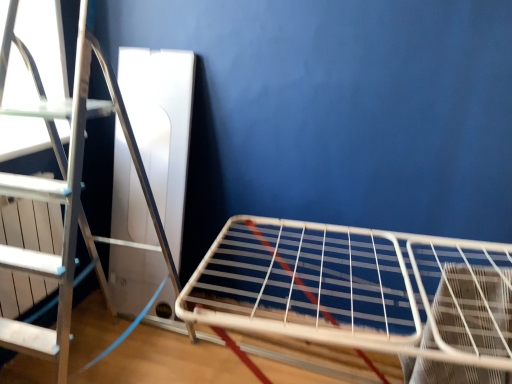
This screenshot has height=384, width=512. Find the location of `white wire rack at lower right`. white wire rack at lower right is located at coordinates (361, 291).

Describe the element at coordinates (361, 291) in the screenshot. I see `white wire rack at lower right` at that location.

In order to face silver metallic ladder at left, should I rotate leftwards or rightwards?

It's best to rotate left around 23.768 degrees.

The height and width of the screenshot is (384, 512). I want to click on silver metallic ladder at left, so click(x=64, y=215).

Describe the element at coordinates (64, 215) in the screenshot. I see `silver metallic ladder at left` at that location.

Find the location of a particular element. This screenshot has height=384, width=512. white wire rack at lower right is located at coordinates click(361, 291).

Would you say white wire rack at lower right is to the left or to the right of silver metallic ladder at left in the picture?

In the image, white wire rack at lower right appears on the right side of silver metallic ladder at left.

In the image, is white wire rack at lower right positioned in front of or behind silver metallic ladder at left?

Visually, white wire rack at lower right is located in front of silver metallic ladder at left.

Considering the points (244, 245) and (21, 47), which point is behind, point (244, 245) or point (21, 47)?

Point (21, 47)

From the image's perspective, relative to silver metallic ladder at left, is white wire rack at lower right above or below?

From the image's perspective, white wire rack at lower right appears below silver metallic ladder at left.

From a real-world perspective, is white wire rack at lower right positioned over silver metallic ladder at left based on gravity?

No, from a real-world perspective, white wire rack at lower right is not above silver metallic ladder at left.

Considering the relative sizes of white wire rack at lower right and silver metallic ladder at left in the image provided, is white wire rack at lower right thinner than silver metallic ladder at left?

Incorrect, the width of white wire rack at lower right is not less than that of silver metallic ladder at left.

Between white wire rack at lower right and silver metallic ladder at left, which one has less height?

white wire rack at lower right.

Is white wire rack at lower right bigger or smaller than silver metallic ladder at left?

In the image, white wire rack at lower right appears to be smaller than silver metallic ladder at left.

Is silver metallic ladder at left surrounded by white wire rack at lower right?

That's incorrect, silver metallic ladder at left is not inside white wire rack at lower right.

Is white wire rack at lower right placed right next to silver metallic ladder at left?

No, white wire rack at lower right is not next to silver metallic ladder at left.

Based on the photo, does white wire rack at lower right turn towards silver metallic ladder at left?

No, white wire rack at lower right is not oriented towards silver metallic ladder at left.

Can you tell me how much white wire rack at lower right and silver metallic ladder at left differ in facing direction?

The angular difference between white wire rack at lower right and silver metallic ladder at left is 84.4 degrees.

Locate an element on the screen. The height and width of the screenshot is (384, 512). ladder that is on the left side of white wire rack at lower right is located at coordinates (64, 215).

Can you confirm if silver metallic ladder at left is positioned to the left of white wire rack at lower right?

Yes.

Is the position of silver metallic ladder at left more distant than that of white wire rack at lower right?

Yes.

Is point (20, 189) closer or farther from the camera than point (390, 268)?

Point (20, 189).

From the image's perspective, is silver metallic ladder at left above or below white wire rack at lower right?

silver metallic ladder at left is above white wire rack at lower right.

From a real-world perspective, is silver metallic ladder at left physically below white wire rack at lower right?

No, from a real-world perspective, silver metallic ladder at left is not below white wire rack at lower right.

Based on the photo, between silver metallic ladder at left and white wire rack at lower right, which one has smaller width?

silver metallic ladder at left is thinner.

Who is taller, silver metallic ladder at left or white wire rack at lower right?

silver metallic ladder at left.

Consider the image. Can you confirm if silver metallic ladder at left is bigger than white wire rack at lower right?

Indeed, silver metallic ladder at left has a larger size compared to white wire rack at lower right.

Is silver metallic ladder at left completely or partially outside of white wire rack at lower right?

Indeed, silver metallic ladder at left is completely outside white wire rack at lower right.

Is silver metallic ladder at left far away from white wire rack at lower right?

No, silver metallic ladder at left is not far away from white wire rack at lower right.

Is silver metallic ladder at left facing towards white wire rack at lower right?

Yes.

How different are the orientations of silver metallic ladder at left and white wire rack at lower right in degrees?

They differ by 84.4 degrees in their facing directions.

How far apart are silver metallic ladder at left and white wire rack at lower right?

silver metallic ladder at left and white wire rack at lower right are 35.91 inches apart from each other.

What are the coordinates of `furniture in front of the silver metallic ladder at left` in the screenshot? It's located at (361, 291).

Find the location of a particular element. The width and height of the screenshot is (512, 384). furniture that is in front of the silver metallic ladder at left is located at coordinates (361, 291).

Locate an element on the screen. furniture that appears on the right of silver metallic ladder at left is located at coordinates (361, 291).